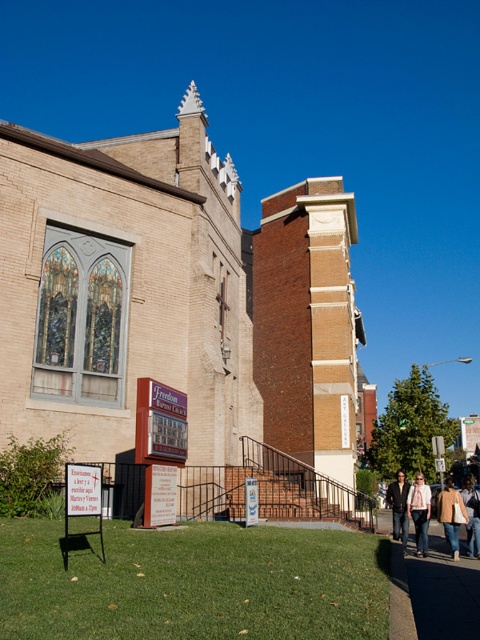
From the picture: You are a visitor standing on the gray concrete sidewalk at lower right and want to place your dark brown leather jacket at lower right on the sidewalk. Based on the size of the sidewalk and jacket, will there be enough space to place the jacket without it hanging off the edge?

The gray concrete sidewalk at lower right has a smaller size compared to dark brown leather jacket at lower right, so placing the jacket on the sidewalk may cause part of it to hang off the edge since the sidewalk is not large enough to accommodate the jacket fully.

You are standing at the entrance of the brick church at center. If you face the direction of the spire, which direction should you turn to see the large, arched stained glass window on the left side of the building?

The large, arched stained glass window on the left side of the building is to your left when facing the spire, so you should turn left to see it.

You are standing in front of the church and see two jackets at the lower right corner of the image. Which one is positioned more to the right between the tan leather jacket at lower right and the dark brown leather jacket at lower right?

The tan leather jacket at lower right is positioned more to the right than the dark brown leather jacket at lower right.